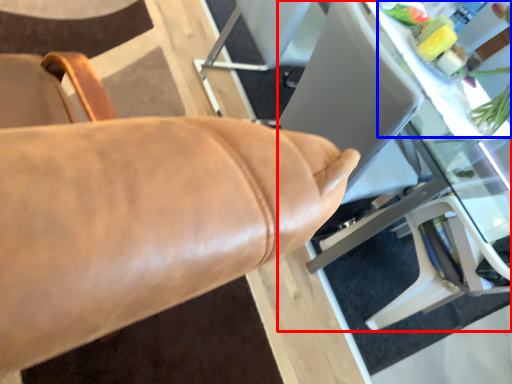
Question: Which point is further to the camera, table (highlighted by a red box) or floral arrangement (highlighted by a blue box)?

Choices:
 (A) table
 (B) floral arrangement

Answer: (B)